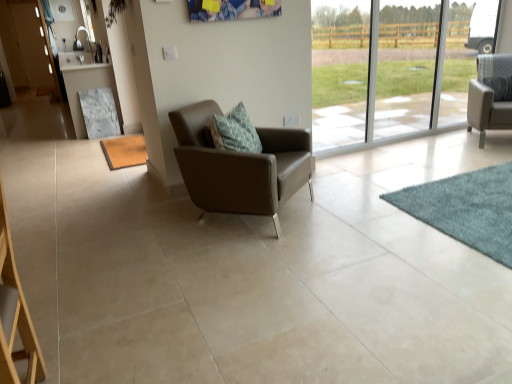
Question: Considering the relative positions of brown textured mat at lower left, arranged as the 1th mat when viewed from the back, and transparent glass window at right in the image provided, is brown textured mat at lower left, arranged as the 1th mat when viewed from the back, to the left of transparent glass window at right from the viewer's perspective?

Choices:
 (A) no
 (B) yes

Answer: (B)

Question: Is brown textured mat at lower left, arranged as the 1th mat when viewed from the back, behind transparent glass window at right?

Choices:
 (A) yes
 (B) no

Answer: (A)

Question: Can you confirm if brown textured mat at lower left, the first mat viewed from the top, is thinner than transparent glass window at right?

Choices:
 (A) no
 (B) yes

Answer: (A)

Question: From a real-world perspective, is brown textured mat at lower left, arranged as the 2th mat when viewed from the right, physically above transparent glass window at right?

Choices:
 (A) no
 (B) yes

Answer: (A)

Question: Is brown textured mat at lower left, the 2th mat ordered from the bottom, looking in the opposite direction of transparent glass window at right?

Choices:
 (A) yes
 (B) no

Answer: (B)

Question: Would you say transparent glass window at right is part of brown textured mat at lower left, the 2th mat ordered from the bottom,'s contents?

Choices:
 (A) yes
 (B) no

Answer: (B)

Question: Does teal carpet at lower right, placed as the 2th mat when sorted from left to right, have a lesser height compared to brown textured mat at lower left, the first mat viewed from the top?

Choices:
 (A) no
 (B) yes

Answer: (A)

Question: Does teal carpet at lower right, the 2th mat from the back, have a greater height compared to brown textured mat at lower left, arranged as the 1th mat when viewed from the back?

Choices:
 (A) yes
 (B) no

Answer: (A)

Question: Considering the relative positions of teal carpet at lower right, the 2th mat from the back, and brown textured mat at lower left, arranged as the 1th mat when viewed from the back, in the image provided, is teal carpet at lower right, the 2th mat from the back, to the left of brown textured mat at lower left, arranged as the 1th mat when viewed from the back, from the viewer's perspective?

Choices:
 (A) no
 (B) yes

Answer: (A)

Question: Is teal carpet at lower right, which is the first mat from bottom to top, closer to camera compared to brown textured mat at lower left, arranged as the 1th mat when viewed from the back?

Choices:
 (A) no
 (B) yes

Answer: (B)

Question: Is the surface of teal carpet at lower right, arranged as the 1th mat when viewed from the front, in direct contact with brown textured mat at lower left, the 1th mat from the left?

Choices:
 (A) yes
 (B) no

Answer: (B)

Question: Is teal carpet at lower right, which ranks as the first mat in right-to-left order, turned away from brown textured mat at lower left, arranged as the 2th mat when viewed from the right?

Choices:
 (A) yes
 (B) no

Answer: (B)

Question: Does marble table at left contain matte wood screen door at upper left?

Choices:
 (A) no
 (B) yes

Answer: (A)